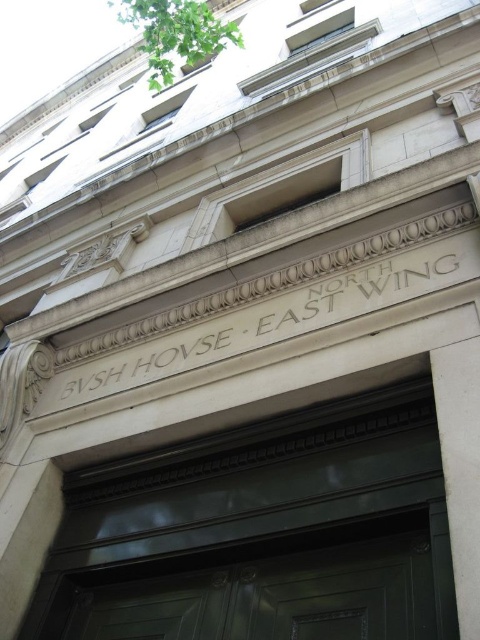
Between point (440, 506) and point (440, 401), which one is positioned behind?

The point (440, 401) is behind.

Based on the photo, can you confirm if green polished wood door at center is shorter than white marble pillar at center?

Incorrect, green polished wood door at center's height does not fall short of white marble pillar at center's.

Find the location of `green polished wood door at center`. green polished wood door at center is located at coordinates (265, 586).

Can you confirm if green polished wood door at center is bigger than white stone engraving at center?

Incorrect, green polished wood door at center is not larger than white stone engraving at center.

Can you confirm if green polished wood door at center is shorter than white stone engraving at center?

No, green polished wood door at center is not shorter than white stone engraving at center.

Where is `green polished wood door at center`? This screenshot has height=640, width=480. green polished wood door at center is located at coordinates (265, 586).

Is white stone engraving at center above white marble pillar at center?

Correct, white stone engraving at center is located above white marble pillar at center.

Who is more forward, (x=205, y=346) or (x=450, y=435)?

Point (x=450, y=435)

Where is `white stone engraving at center`? This screenshot has width=480, height=640. white stone engraving at center is located at coordinates (260, 324).